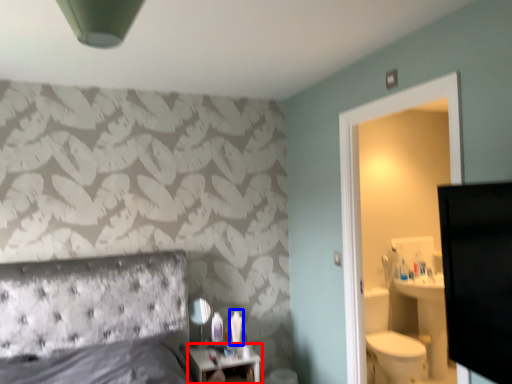
Question: Which object is closer to the camera taking this photo, nightstand (highlighted by a red box) or toiletry (highlighted by a blue box)?

Choices:
 (A) nightstand
 (B) toiletry

Answer: (A)